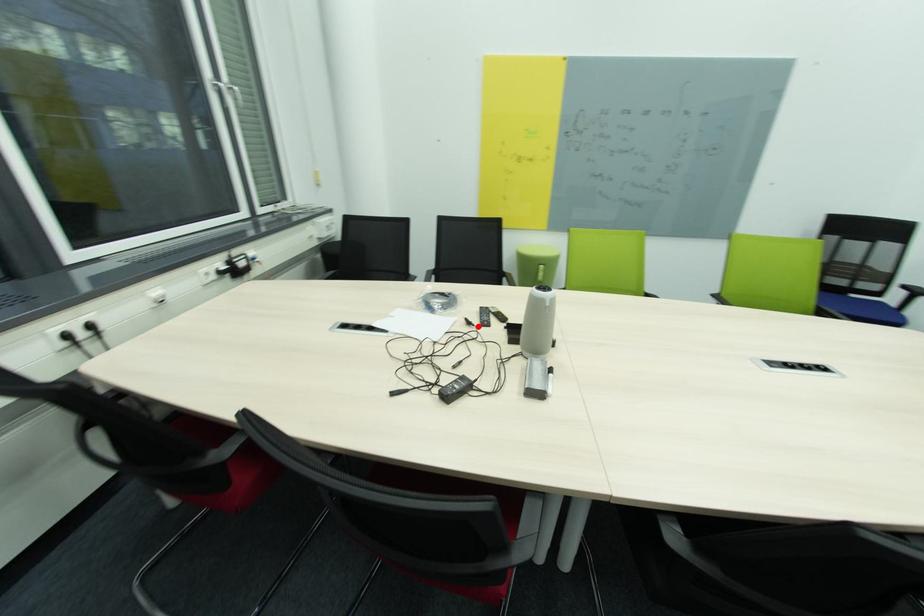
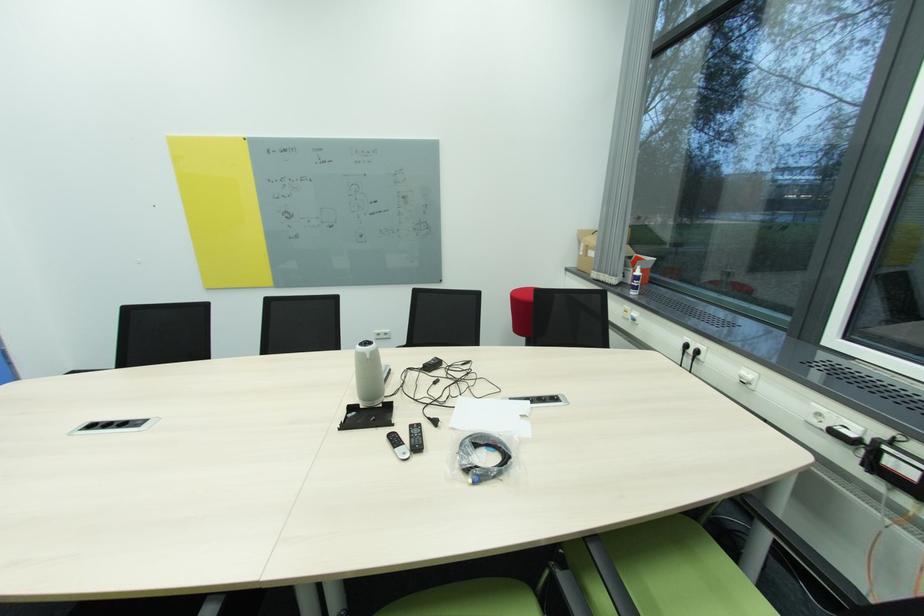
Where in the second image is the point corresponding to the highlighted location from the first image?

(433, 419)